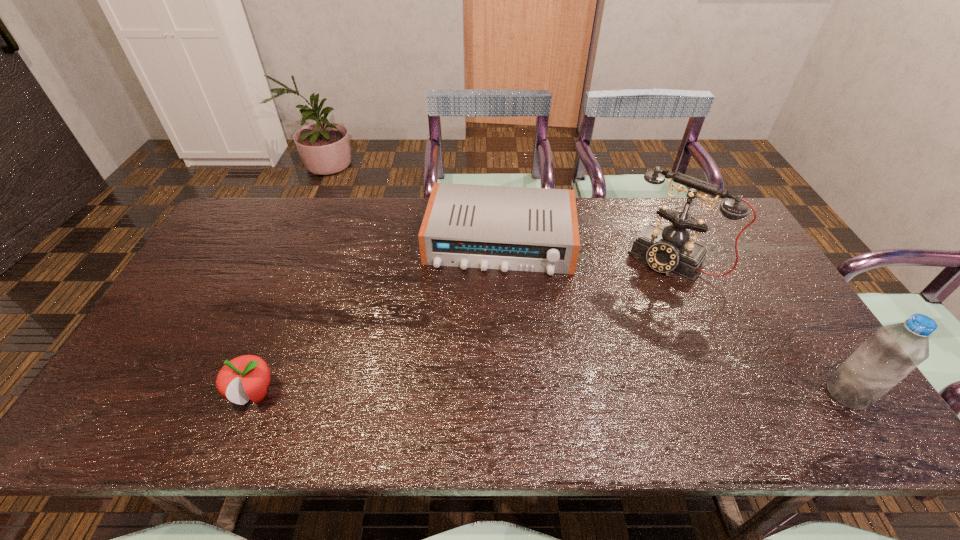
Identify the location of vacant space that satisfies the following two spatial constraints: 1. on the front side of the water bottle; 2. on the left side of the third object from left to right. The image size is (960, 540). (732, 393).